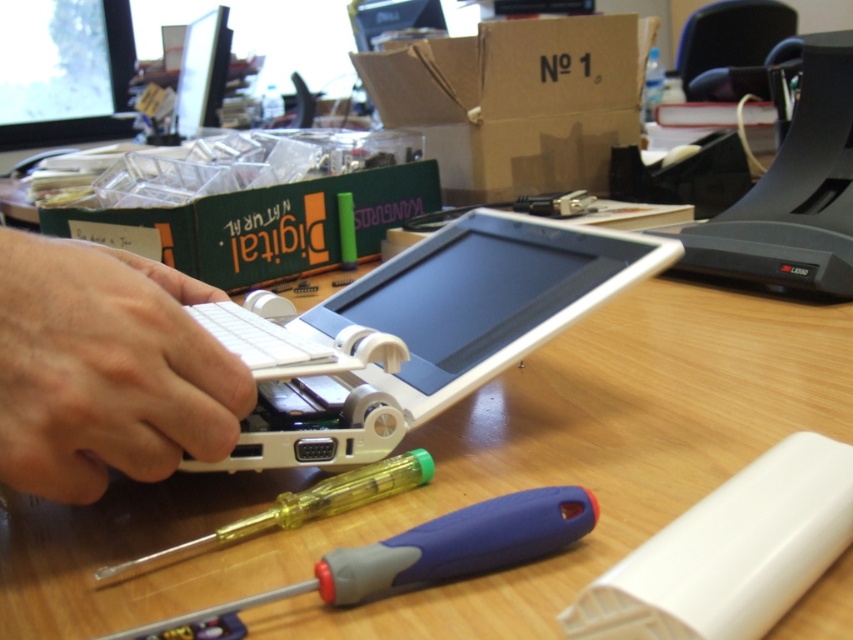
Question: Which point is farther from the camera taking this photo?

Choices:
 (A) (379, 285)
 (B) (495, 561)
 (C) (740, 428)
 (D) (148, 566)

Answer: (A)

Question: Which point is farther from the camera taking this photo?

Choices:
 (A) (297, 516)
 (B) (457, 532)
 (C) (358, 406)

Answer: (C)

Question: Which object is closer to the camera taking this photo?

Choices:
 (A) white plastic tablet at center
 (B) wooden table at center
 (C) blue plastic screwdriver at lower center

Answer: (C)

Question: Can you confirm if white plastic tablet at center is bigger than blue plastic screwdriver at lower center?

Choices:
 (A) yes
 (B) no

Answer: (A)

Question: Can you confirm if white matte keyboard at left is positioned to the right of blue plastic screwdriver at lower center?

Choices:
 (A) yes
 (B) no

Answer: (B)

Question: Is white plastic tablet at center bigger than white matte keyboard at left?

Choices:
 (A) no
 (B) yes

Answer: (B)